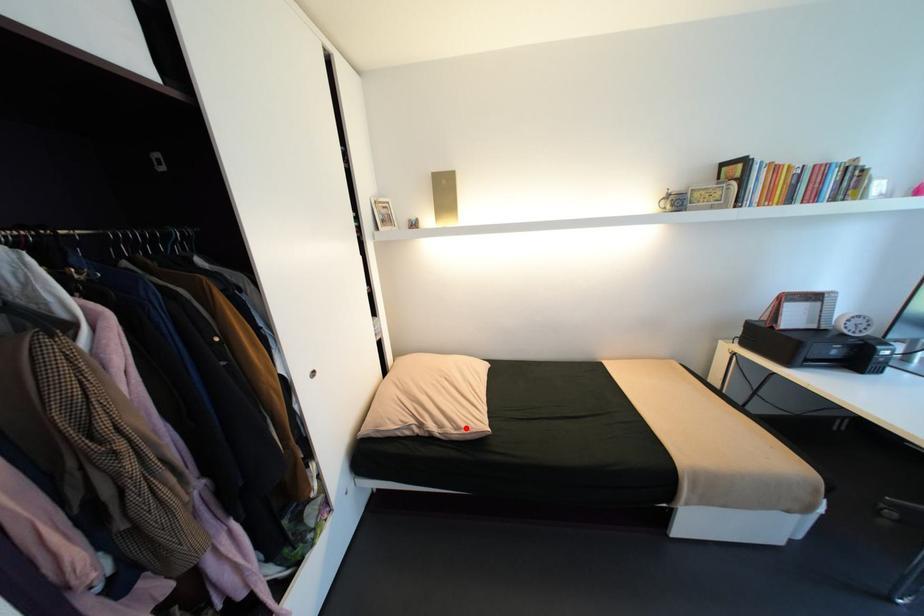
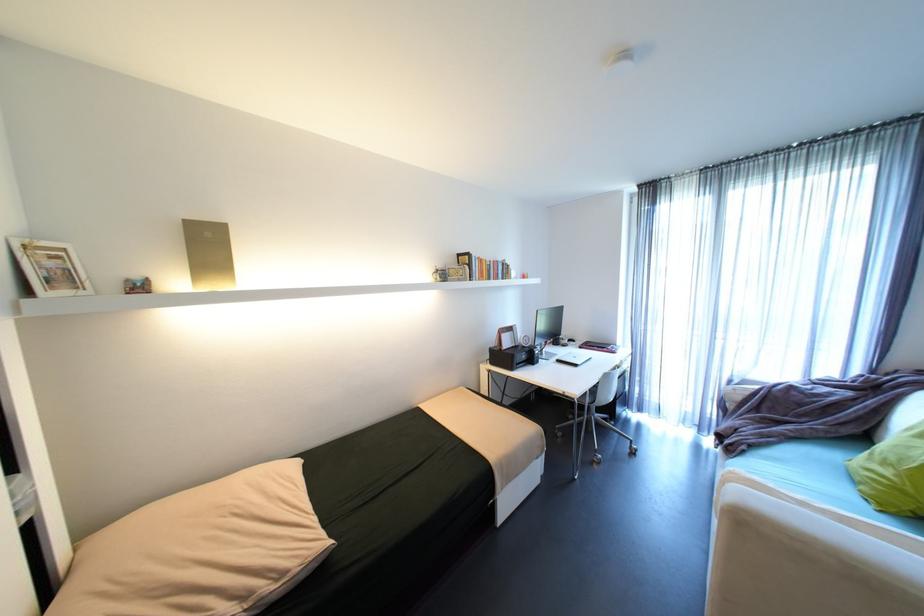
In the second image, find the point that corresponds to the highlighted location in the first image.

(289, 575)